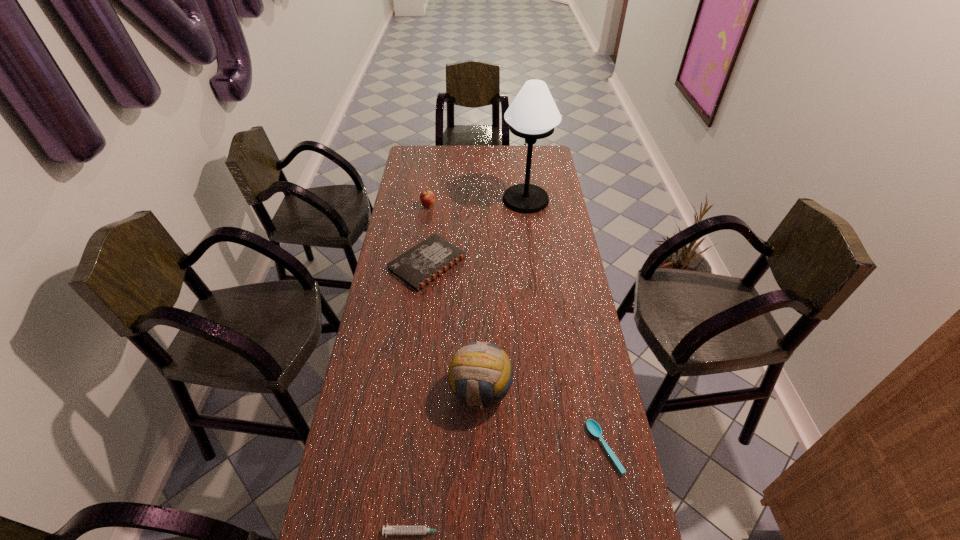
Find the location of `free region located on the left of the volleyball`. free region located on the left of the volleyball is located at coordinates (364, 390).

Where is `free location located 0.100m on the left of the apple`? free location located 0.100m on the left of the apple is located at coordinates (398, 207).

Image resolution: width=960 pixels, height=540 pixels. I want to click on vacant region located on the front of the third farthest object, so [414, 377].

Locate an element on the screen. The width and height of the screenshot is (960, 540). vacant space located 0.150m at the needle end of the nearest object is located at coordinates (510, 532).

Locate an element on the screen. The width and height of the screenshot is (960, 540). vacant area situated on the back of the spoon is located at coordinates (587, 360).

The image size is (960, 540). I want to click on apple at the left edge, so click(427, 198).

At what (x,y) coordinates should I click in order to perform the action: click on notebook that is positioned at the left edge. Please return your answer as a coordinate pair (x, y). The image size is (960, 540). Looking at the image, I should click on (417, 267).

Where is `syringe positioned at the left edge`? syringe positioned at the left edge is located at coordinates (389, 530).

In order to click on table lamp that is at the right edge in this screenshot , I will do `click(533, 114)`.

This screenshot has width=960, height=540. In order to click on spoon that is at the right edge in this screenshot , I will do `click(594, 428)`.